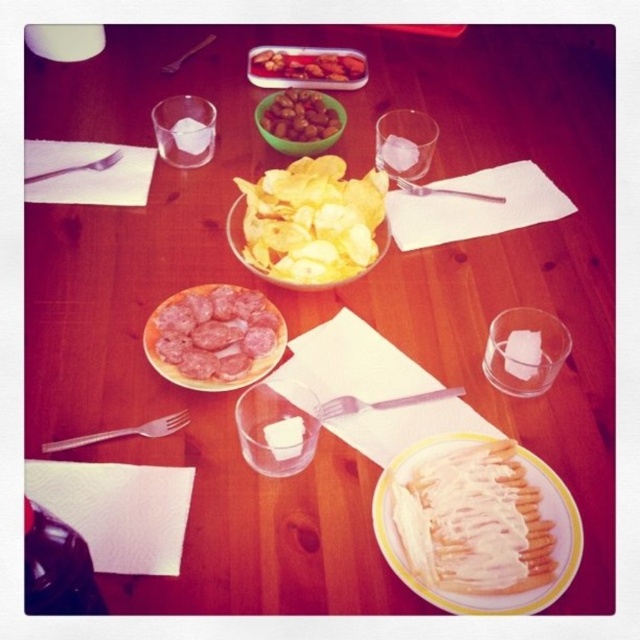
Can you confirm if shiny brown nuts at center is taller than matte silver fork at left?

Correct, shiny brown nuts at center is much taller as matte silver fork at left.

Between shiny brown nuts at center and matte silver fork at left, which one has less height?

With less height is matte silver fork at left.

Does point (285, 136) come behind point (56, 173)?

Yes, it is behind point (56, 173).

Where is `shiny brown nuts at center`? shiny brown nuts at center is located at coordinates (x=300, y=115).

Can you confirm if sliced salami at center is wider than pink plastic fork at center?

In fact, sliced salami at center might be narrower than pink plastic fork at center.

Is sliced salami at center below pink plastic fork at center?

Incorrect, sliced salami at center is not positioned below pink plastic fork at center.

I want to click on sliced salami at center, so click(214, 337).

This screenshot has width=640, height=640. Identify the location of sliced salami at center. (214, 337).

Does yellow crispy chips at center have a lesser width compared to silver metallic fork at left?

In fact, yellow crispy chips at center might be wider than silver metallic fork at left.

Does yellow crispy chips at center come behind silver metallic fork at left?

Yes, it is.

I want to click on yellow crispy chips at center, so click(310, 221).